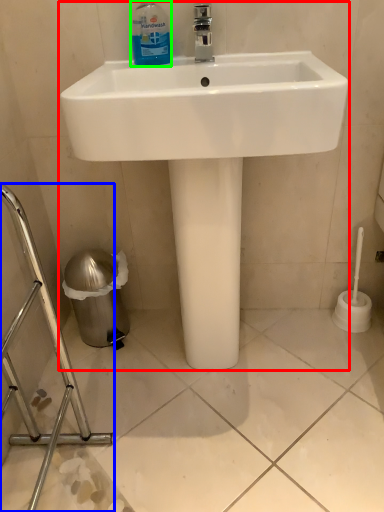
Question: Based on their relative distances, which object is nearer to sink (highlighted by a red box)? Choose from porcelain (highlighted by a blue box) and cleaning product (highlighted by a green box).

Choices:
 (A) porcelain
 (B) cleaning product

Answer: (B)